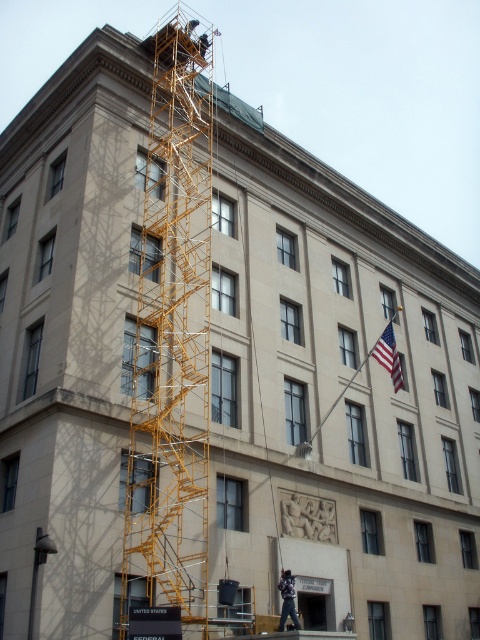
Question: Is american flag at upper right thinner than dark blue jeans at lower center?

Choices:
 (A) yes
 (B) no

Answer: (B)

Question: Can you confirm if american flag at upper right is wider than dark blue jeans at lower center?

Choices:
 (A) yes
 (B) no

Answer: (A)

Question: Estimate the real-world distances between objects in this image. Which object is closer to the dark blue jeans at lower center?

Choices:
 (A) yellow metal scaffolding at upper left
 (B) american flag at upper right

Answer: (A)

Question: Is yellow metal scaffolding at upper left further to the viewer compared to dark blue jeans at lower center?

Choices:
 (A) no
 (B) yes

Answer: (A)

Question: Among these objects, which one is nearest to the camera?

Choices:
 (A) dark blue jeans at lower center
 (B) yellow metal scaffolding at upper left

Answer: (B)

Question: Which of these objects is positioned farthest from the dark blue jeans at lower center?

Choices:
 (A) yellow metal scaffolding at upper left
 (B) american flag at upper right

Answer: (B)